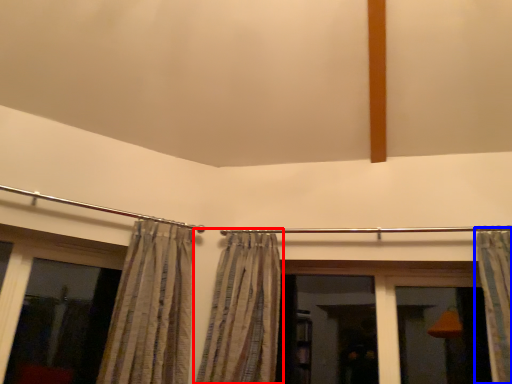
Question: Which object appears farthest to the camera in this image, curtain (highlighted by a red box) or curtain (highlighted by a blue box)?

Choices:
 (A) curtain
 (B) curtain

Answer: (A)